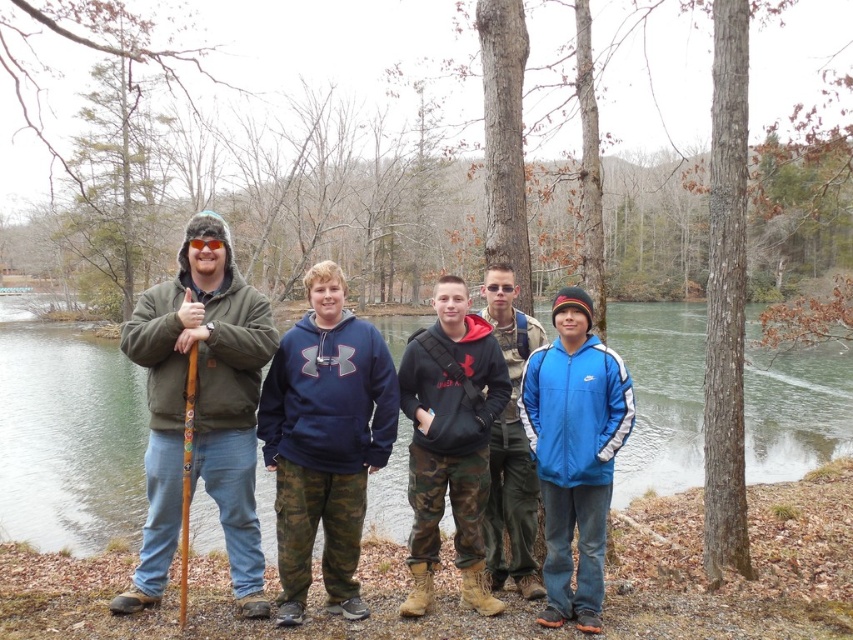
Between point (363, 368) and point (474, 508), which one is positioned in front?

Point (363, 368) is in front.

Which is in front, point (281, 365) or point (485, 355)?

Point (281, 365)

Where is `navy blue fleece at center`? This screenshot has height=640, width=853. navy blue fleece at center is located at coordinates (325, 442).

Which of these two, green matte jacket at left or navy blue fleece at center, stands shorter?

green matte jacket at left is shorter.

Who is taller, green matte jacket at left or navy blue fleece at center?

Standing taller between the two is navy blue fleece at center.

Where is `green matte jacket at left`? green matte jacket at left is located at coordinates (201, 406).

Where is `green matte jacket at left`? This screenshot has height=640, width=853. green matte jacket at left is located at coordinates (201, 406).

Image resolution: width=853 pixels, height=640 pixels. Find the location of `greenish water at center`. greenish water at center is located at coordinates (68, 438).

Does greenish water at center come in front of camo pants at center?

Yes.

Image resolution: width=853 pixels, height=640 pixels. What are the coordinates of `greenish water at center` in the screenshot? It's located at (68, 438).

Identify the location of greenish water at center. (68, 438).